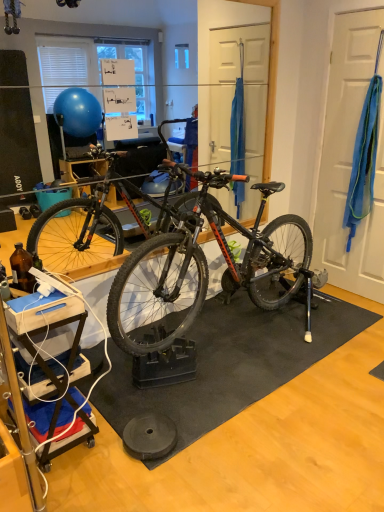
The image size is (384, 512). I want to click on vacant area on top of black rubber mat at center (from a real-world perspective), so click(x=252, y=346).